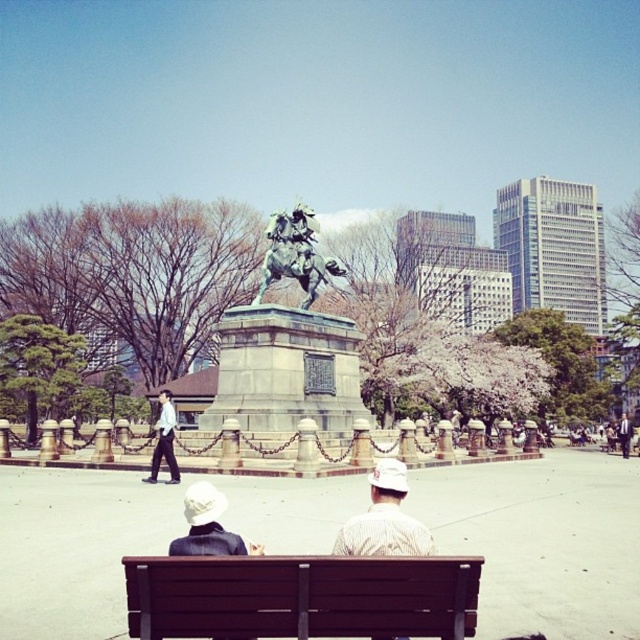
You are standing at the point with coordinates point [172,458] and want to walk towards the statue of a horse and rider. Will you pass by point [620,433] on your way?

Point [172,458] is in front of point [620,433], so if you are facing the statue of a horse and rider, walking towards it would mean moving away from point [620,433]. Therefore, you will not pass by point [620,433] on your way.

From the picture: You are a photographer trying to capture a photo of the bronze statue at center and the white shirt at center in the park scene. Based on their sizes, which object should you focus on first if you want to ensure both are in frame without moving the camera?

The bronze statue at center is taller than the white shirt at center, so you should focus on the bronze statue at center first to ensure both fit in the frame.

From the picture: You are standing at the entrance of the park and want to find the white shirt at center. According to the coordinates provided, in which direction should you walk to reach it?

The white shirt at center is located at point (164,440). Since the coordinates are in the center area, you should walk straight ahead towards the central part of the park to reach it.